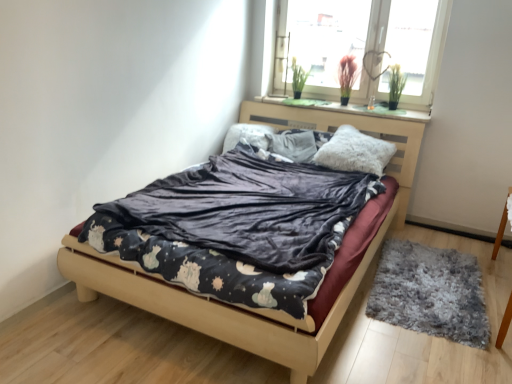
Question: Considering the positions of white fluffy pillow at center, the third pillow when ordered from left to right, and velvet dark blue bed at center in the image, is white fluffy pillow at center, the third pillow when ordered from left to right, wider or thinner than velvet dark blue bed at center?

Choices:
 (A) wide
 (B) thin

Answer: (B)

Question: Is white fluffy pillow at center, the third pillow when ordered from left to right, taller or shorter than velvet dark blue bed at center?

Choices:
 (A) short
 (B) tall

Answer: (B)

Question: Which object is the closest to the velvet dark blue blanket at center?

Choices:
 (A) green felt at upper center
 (B) velvet dark blue bed at center
 (C) fluffy white pillow at center, the 1th pillow viewed from the left
 (D) white fluffy pillow at center, the third pillow when ordered from left to right
 (E) fluffy white pillow at center, which is the 2th pillow in right-to-left order

Answer: (B)

Question: Estimate the real-world distances between objects in this image. Which object is closer to the velvet dark blue blanket at center?

Choices:
 (A) fluffy white pillow at center, arranged as the third pillow when viewed from the right
 (B) fluffy white pillow at center, which is the 2th pillow in right-to-left order
 (C) gray shaggy rug at lower right
 (D) velvet dark blue bed at center
 (E) transparent glass window at upper center

Answer: (D)